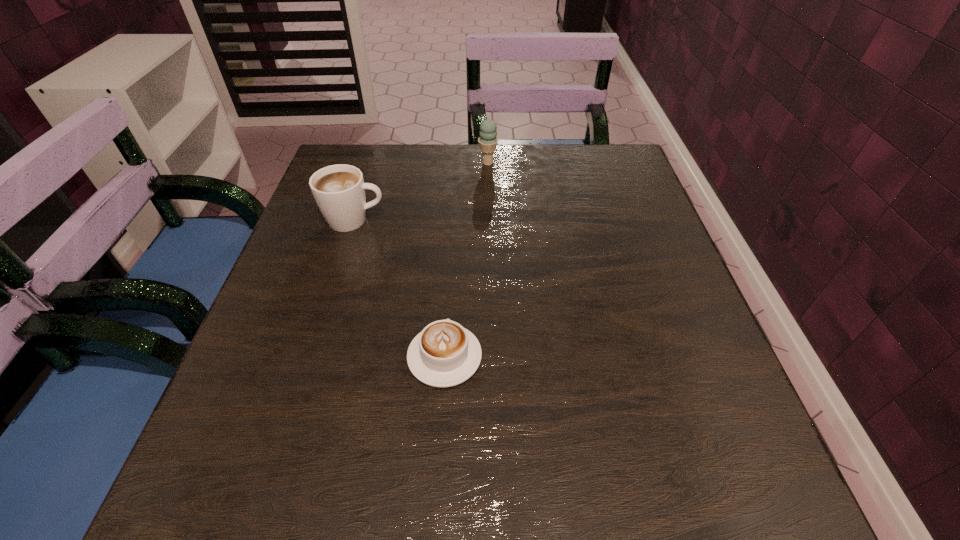
Image resolution: width=960 pixels, height=540 pixels. Find the location of `object positioned at the far edge`. object positioned at the far edge is located at coordinates (487, 141).

At what (x,y) coordinates should I click in order to perform the action: click on object at the left edge. Please return your answer as a coordinate pair (x, y). The height and width of the screenshot is (540, 960). Looking at the image, I should click on (339, 190).

Find the location of a particular element. blank area at the near edge is located at coordinates (392, 483).

You are a GUI agent. You are given a task and a screenshot of the screen. Output one action in this format:
    pyautogui.click(x=<x>, y=<y>)
    Task: Click on the blank space at the right edge of the desktop
    This screenshot has height=540, width=960.
    Given the screenshot: What is the action you would take?
    pyautogui.click(x=637, y=307)

You are a GUI agent. You are given a task and a screenshot of the screen. Output one action in this format:
    pyautogui.click(x=<x>, y=<y>)
    Task: Click on the vacant region at the far left corner of the desktop
    
    Given the screenshot: What is the action you would take?
    pyautogui.click(x=331, y=163)

The image size is (960, 540). In order to click on vacant space at the far right corner of the desktop in this screenshot , I will do `click(644, 191)`.

The image size is (960, 540). In the image, there is a desktop. Identify the location of vacant space at the near right corner. (749, 484).

This screenshot has width=960, height=540. I want to click on free space that is in between the leftmost object and the shorter cappuccino, so click(399, 288).

In order to click on free space between the taller cappuccino and the farthest object in this screenshot , I will do `click(421, 192)`.

Where is `free space between the right cappuccino and the left cappuccino`? free space between the right cappuccino and the left cappuccino is located at coordinates (399, 288).